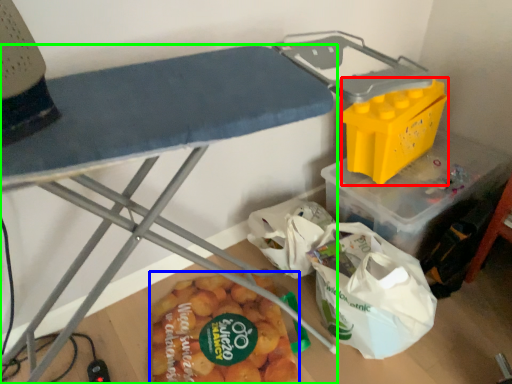
Question: Based on their relative distances, which object is farther from box (highlighted by a red box)? Choose from food (highlighted by a blue box) and furniture (highlighted by a green box).

Choices:
 (A) food
 (B) furniture

Answer: (B)